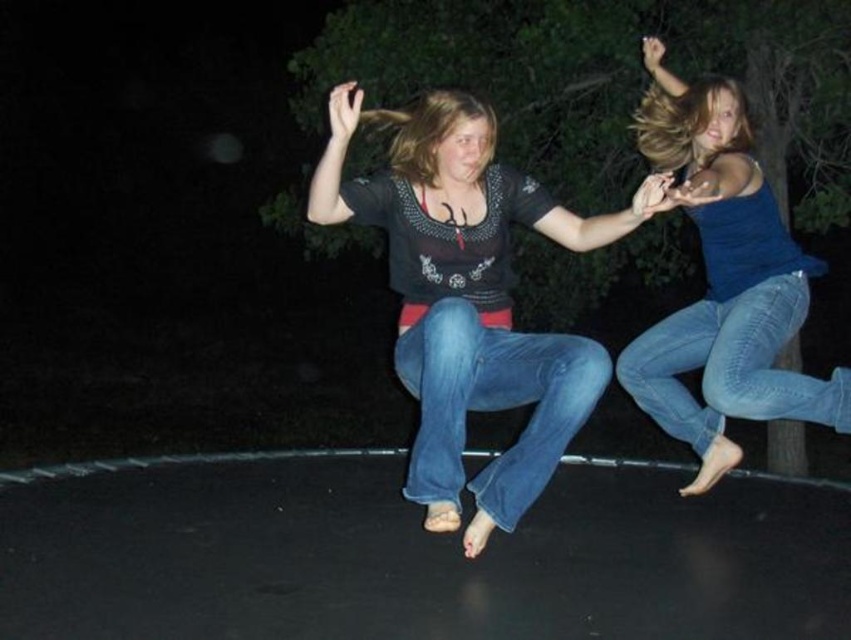
You are standing at the camera position and want to know how far the point at coordinates (635,122) is from you. Can you determine the distance?

The distance between the point at coordinates (635,122) and the camera is 4.81 meters.

You are a photographer trying to capture the perfect shot of the two people jumping off the trampoline. You notice the matte black shirt at center and the blue denim jeans at center. Which object should you focus on first if you want to capture the person on the left side of the image?

The blue denim jeans at center should be focused on first because the matte black shirt at center is positioned on the right side of the blue denim jeans at center, meaning the blue denim jeans are closer to the left side of the image.